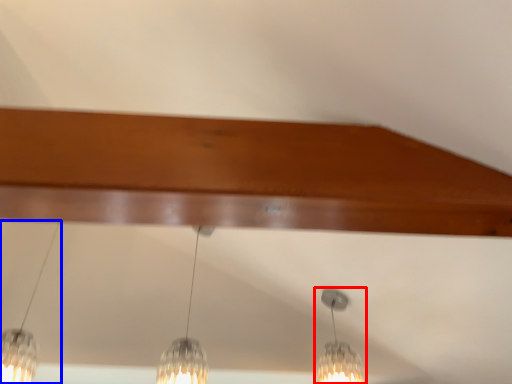
Question: Which object appears farthest to the camera in this image, lamp (highlighted by a red box) or lamp (highlighted by a blue box)?

Choices:
 (A) lamp
 (B) lamp

Answer: (A)